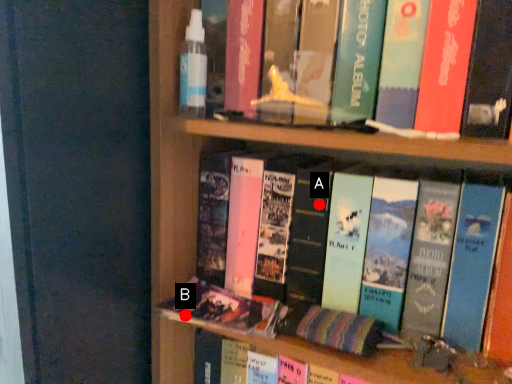
Question: Two points are circled on the image, labeled by A and B beside each circle. Which point is farther to the camera?

Choices:
 (A) A is further
 (B) B is further

Answer: (A)